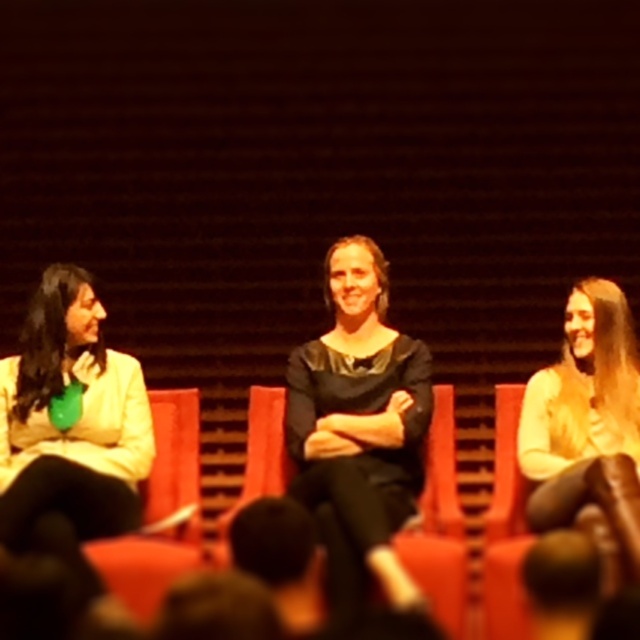
Question: Which object is closer to the camera taking this photo?

Choices:
 (A) light beige sweater at center
 (B) matte red chair at center
 (C) matte yellow jacket at left
 (D) smooth leather chair at center

Answer: (A)

Question: Among these objects, which one is farthest from the camera?

Choices:
 (A) smooth leather chair at center
 (B) matte red chair at center
 (C) matte yellow jacket at left
 (D) black matte dress at center

Answer: (A)

Question: Does matte yellow jacket at left have a smaller size compared to matte red chair at center?

Choices:
 (A) no
 (B) yes

Answer: (A)

Question: Is light beige sweater at center closer to camera compared to smooth leather chair at center?

Choices:
 (A) yes
 (B) no

Answer: (A)

Question: Based on their relative distances, which object is farther from the black matte dress at center?

Choices:
 (A) matte red chair at center
 (B) light beige sweater at center
 (C) matte yellow jacket at left

Answer: (C)

Question: Does matte yellow jacket at left lie in front of smooth leather chair at center?

Choices:
 (A) yes
 (B) no

Answer: (A)